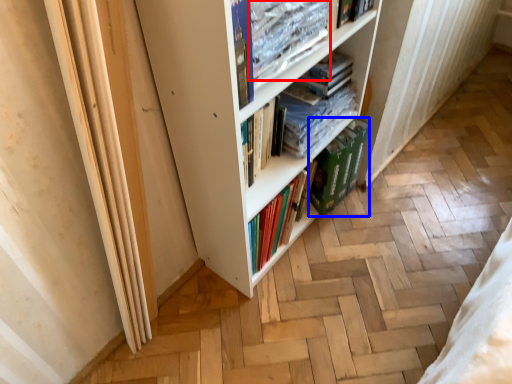
Question: Which object appears closest to the camera in this image, book (highlighted by a red box) or paperback book (highlighted by a blue box)?

Choices:
 (A) book
 (B) paperback book

Answer: (A)